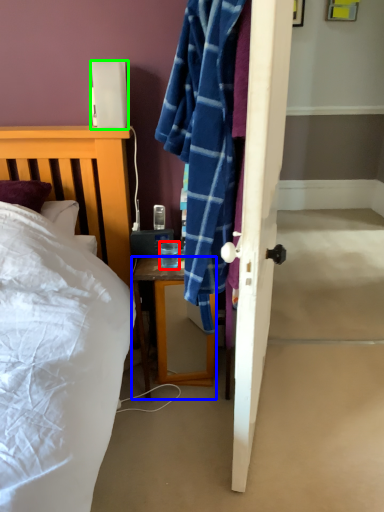
Question: Which object is the farthest from coffee cup (highlighted by a red box)? Choose among these: desk (highlighted by a blue box) or lamp (highlighted by a green box).

Choices:
 (A) desk
 (B) lamp

Answer: (B)